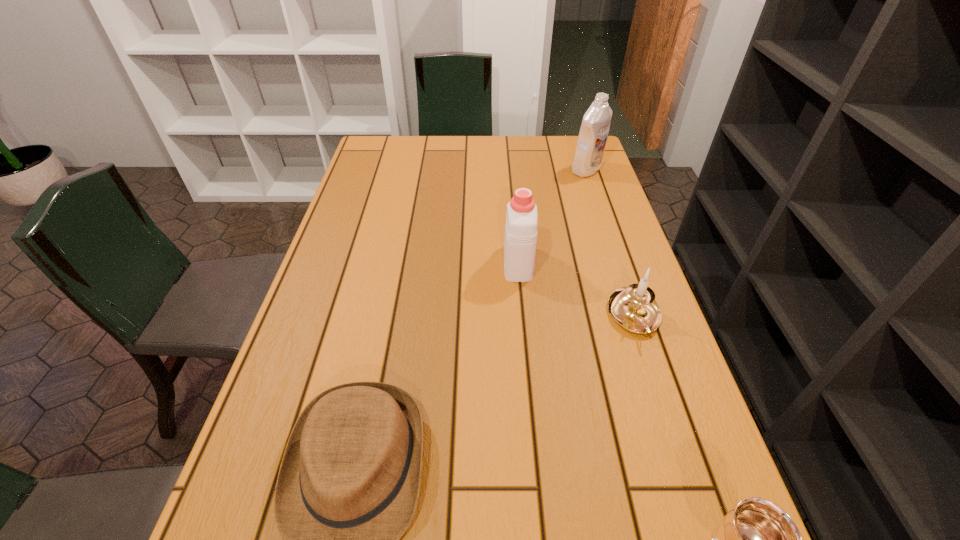
You are a GUI agent. You are given a task and a screenshot of the screen. Output one action in this format:
    pyautogui.click(x=<x>, y=<y>)
    Task: Click on the vacant space in between the left detergent and the candle holder
    This screenshot has width=960, height=540.
    Given the screenshot: What is the action you would take?
    pyautogui.click(x=576, y=290)

Identify the location of the second closest object relative to the leftmost object. (634, 308).

Identify which object is located as the nearest to the fedora. Please provide its 2D coordinates. Your answer should be formatted as a tuple, i.e. [(x, y)], where the tuple contains the x and y coordinates of a point satisfying the conditions above.

[(521, 223)]

At what (x,y) coordinates should I click in order to perform the action: click on free space in the image that satisfies the following two spatial constraints: 1. on the handle side of the farther detergent; 2. on the right side of the shorter detergent. Please return your answer as a coordinate pair (x, y). This screenshot has height=540, width=960. Looking at the image, I should click on (509, 170).